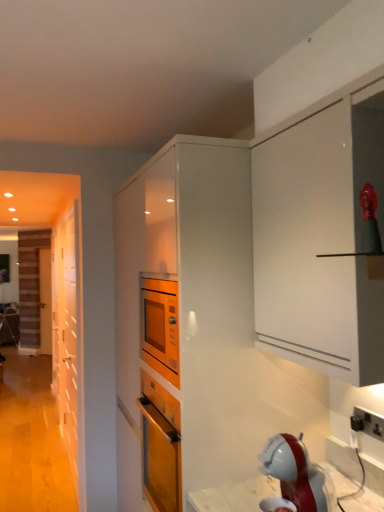
Question: Considering the positions of point (49, 352) and point (200, 228), is point (49, 352) closer or farther from the camera than point (200, 228)?

Choices:
 (A) farther
 (B) closer

Answer: (A)

Question: In terms of height, does wooden at left, placed as the 1th door when sorted from back to front, look taller or shorter compared to white glossy cabinet at center?

Choices:
 (A) tall
 (B) short

Answer: (B)

Question: Estimate the real-world distances between objects in this image. Which object is farther from the black plastic electrical outlet at lower right?

Choices:
 (A) white glossy cabinet at center
 (B) wooden at left, the first door when ordered from left to right
 (C) wooden door at left, which is the 2th door from back to front

Answer: (B)

Question: Considering the real-world distances, which object is closest to the wooden door at left, the first door when ordered from right to left?

Choices:
 (A) black plastic electrical outlet at lower right
 (B) white glossy cabinet at center
 (C) wooden at left, the first door when ordered from left to right

Answer: (B)